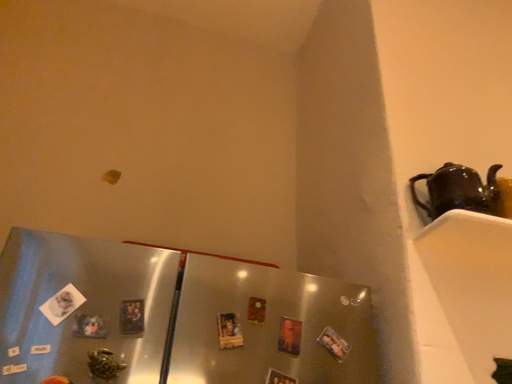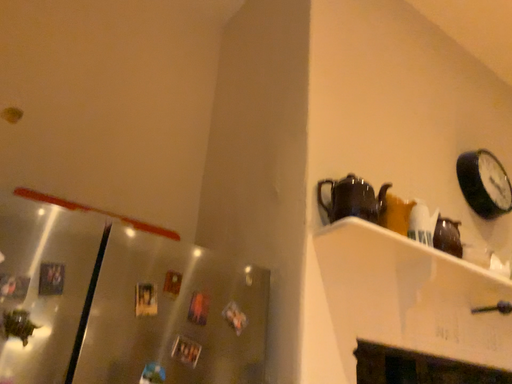
Question: How did the camera likely rotate when shooting the video?

Choices:
 (A) rotated upward
 (B) rotated downward

Answer: (B)